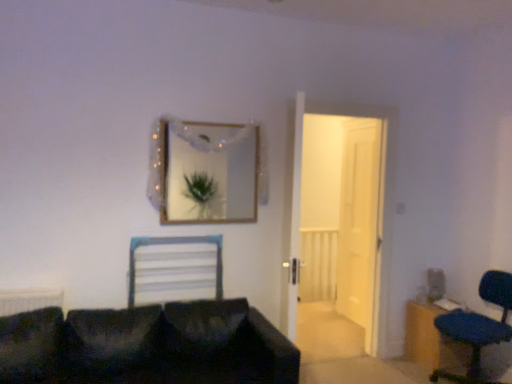
Locate an element on the screen. Image resolution: width=512 pixels, height=384 pixels. empty space that is ontop of white glossy door at center, which is the 1th door in front-to-back order is located at coordinates (343, 99).